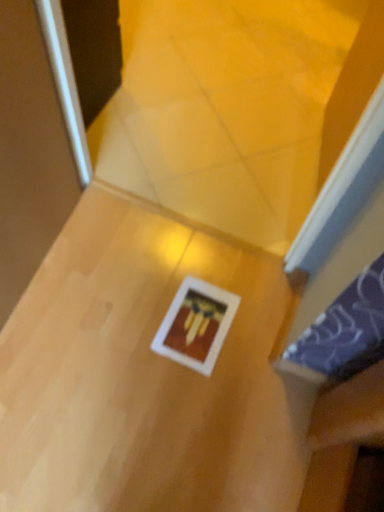
Question: Is wooden table at center smaller than white matte picture frame at center?

Choices:
 (A) no
 (B) yes

Answer: (A)

Question: From the image's perspective, is wooden table at center located above white matte picture frame at center?

Choices:
 (A) no
 (B) yes

Answer: (A)

Question: From a real-world perspective, is wooden table at center under white matte picture frame at center?

Choices:
 (A) yes
 (B) no

Answer: (B)

Question: Is wooden table at center to the left of white matte picture frame at center from the viewer's perspective?

Choices:
 (A) yes
 (B) no

Answer: (A)

Question: Would you say wooden table at center is a long distance from white matte picture frame at center?

Choices:
 (A) yes
 (B) no

Answer: (B)

Question: Could you tell me if wooden table at center is turned towards white matte picture frame at center?

Choices:
 (A) no
 (B) yes

Answer: (B)

Question: Is white matte picture frame at center touching wooden table at center?

Choices:
 (A) yes
 (B) no

Answer: (B)

Question: Considering the relative sizes of white matte picture frame at center and wooden table at center in the image provided, is white matte picture frame at center shorter than wooden table at center?

Choices:
 (A) no
 (B) yes

Answer: (B)

Question: Is white matte picture frame at center positioned with its back to wooden table at center?

Choices:
 (A) no
 (B) yes

Answer: (B)

Question: From a real-world perspective, is white matte picture frame at center below wooden table at center?

Choices:
 (A) no
 (B) yes

Answer: (B)

Question: From a real-world perspective, does white matte picture frame at center stand above wooden table at center?

Choices:
 (A) no
 (B) yes

Answer: (A)

Question: Considering the relative positions of white matte picture frame at center and wooden table at center in the image provided, is white matte picture frame at center behind wooden table at center?

Choices:
 (A) yes
 (B) no

Answer: (A)

Question: Relative to wooden table at center, is white matte picture frame at center in front or behind?

Choices:
 (A) behind
 (B) front

Answer: (A)